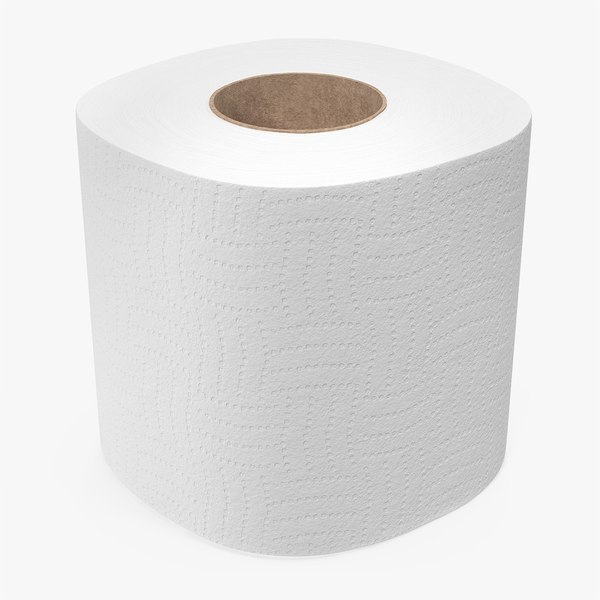
This screenshot has width=600, height=600. Identify the location of left bottom edge of toilet paper roll. (104, 459).